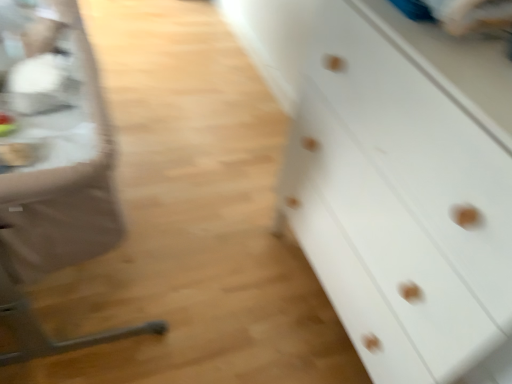
Image resolution: width=512 pixels, height=384 pixels. What are the coordinates of `free area in between metallic silver feeding chair at left and white matte chest of drawers at right` in the screenshot? It's located at (211, 255).